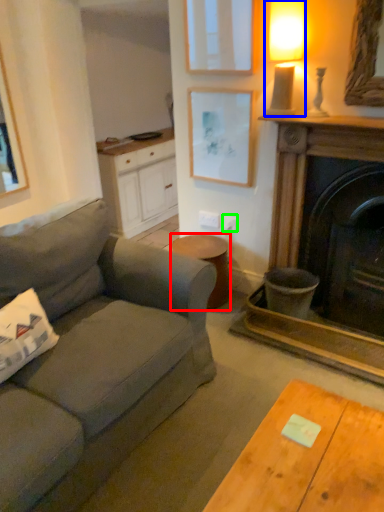
Question: Which object is positioned closest to stool (highlighted by a red box)? Select from lamp (highlighted by a blue box) and power outlet (highlighted by a green box).

Choices:
 (A) lamp
 (B) power outlet

Answer: (B)